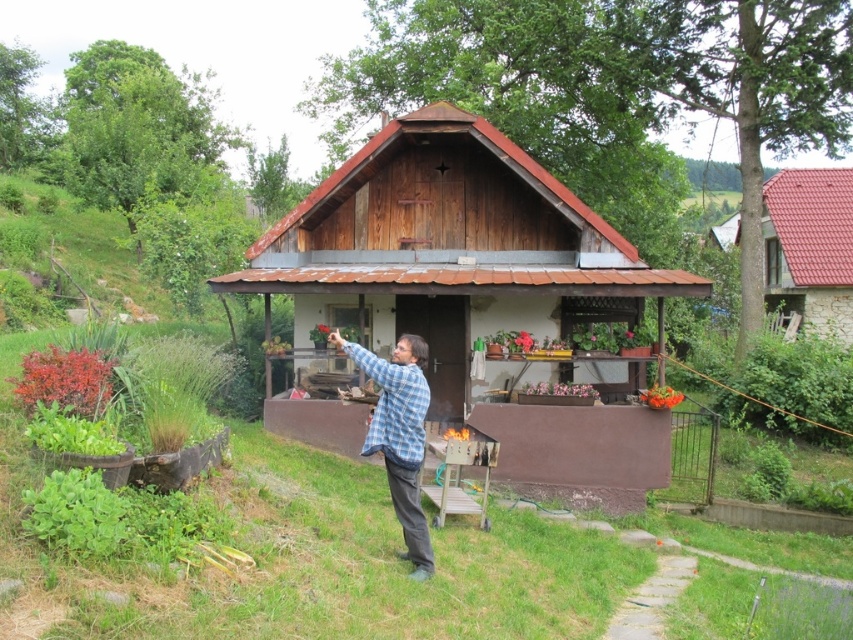
Between point (378, 278) and point (802, 260), which one is positioned behind?

Point (802, 260)

In the scene shown: Is wooden cabin at center above red tile roof at upper right?

Indeed, wooden cabin at center is positioned over red tile roof at upper right.

Between point (407, 241) and point (799, 230), which one is positioned in front?

Point (407, 241)

Where is `wooden cabin at center`? This screenshot has height=640, width=853. wooden cabin at center is located at coordinates (450, 250).

Is the position of green grass at lower center less distant than that of red tile roof at upper right?

Yes, it is in front of red tile roof at upper right.

Does green grass at lower center appear over red tile roof at upper right?

Actually, green grass at lower center is below red tile roof at upper right.

Where is `green grass at lower center`? The image size is (853, 640). green grass at lower center is located at coordinates (312, 557).

Is green grass at lower center further to the viewer compared to wooden cabin at center?

No, it is not.

Does point (59, 557) lie in front of point (254, 260)?

Yes, it is.

Locate an element on the screen. The image size is (853, 640). green grass at lower center is located at coordinates (312, 557).